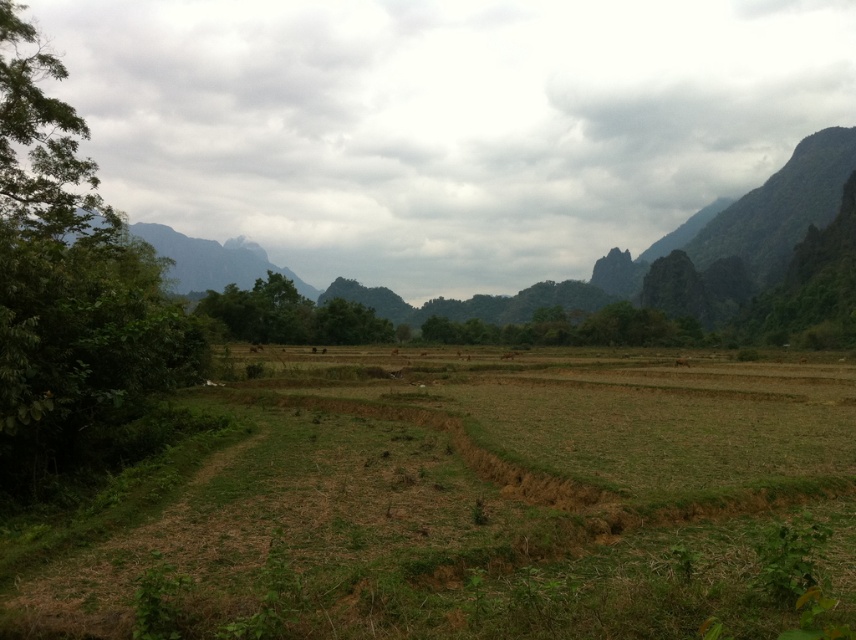
You are a farmer planning to plant crops in the green grassy field at center and the green leafy tree at left. Based on the scene description, which area would be more suitable for planting crops and why?

The green grassy field at center is more suitable for planting crops because it is located below the green leafy tree at left, which may provide shade and nutrients to the crops.

You are a hiker standing in the rural landscape. You notice the green leafy tree at left and the rugged granite mountain at upper left. Which object is closer to you?

The green leafy tree at left is closer to you because it is positioned in front of the rugged granite mountain at upper left.